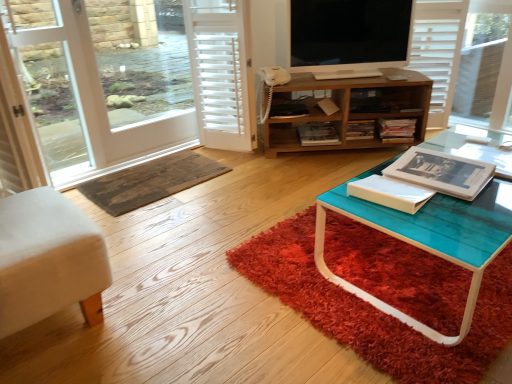
This screenshot has width=512, height=384. In order to click on blank space to the left of shaggy red rug at lower center, the first doormat positioned from the right in this screenshot , I will do `click(190, 257)`.